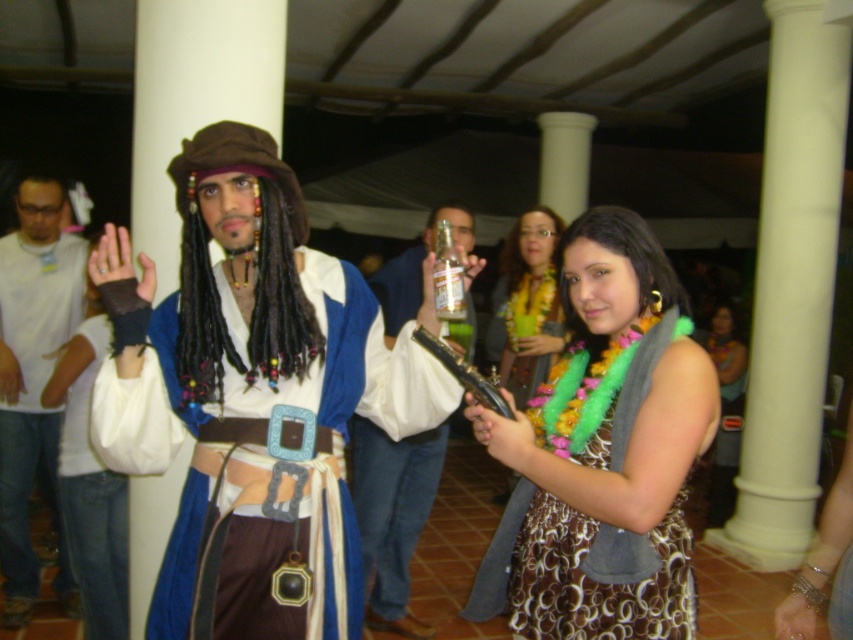
Question: Which point is farther from the camera taking this photo?

Choices:
 (A) (335, 611)
 (B) (389, 268)
 (C) (96, 602)

Answer: (B)

Question: Where is white cotton shirt at left located in relation to matte plastic bottle at center in the image?

Choices:
 (A) below
 (B) above

Answer: (B)

Question: Estimate the real-world distances between objects in this image. Which object is closer to the fluffy green boa at center?

Choices:
 (A) matte blue fabric shirt at center
 (B) blue velvet robe at center
 (C) fluffy green lei at center
 (D) matte plastic bottle at center

Answer: (D)

Question: Is matte plastic bottle at center below floral dress at center?

Choices:
 (A) yes
 (B) no

Answer: (A)

Question: Which of the following is the farthest from the observer?

Choices:
 (A) (537, 496)
 (B) (114, 568)
 (C) (735, 330)
 (D) (100, 280)

Answer: (C)

Question: Can you confirm if matte plastic bottle at center is positioned above floral dress at center?

Choices:
 (A) yes
 (B) no

Answer: (B)